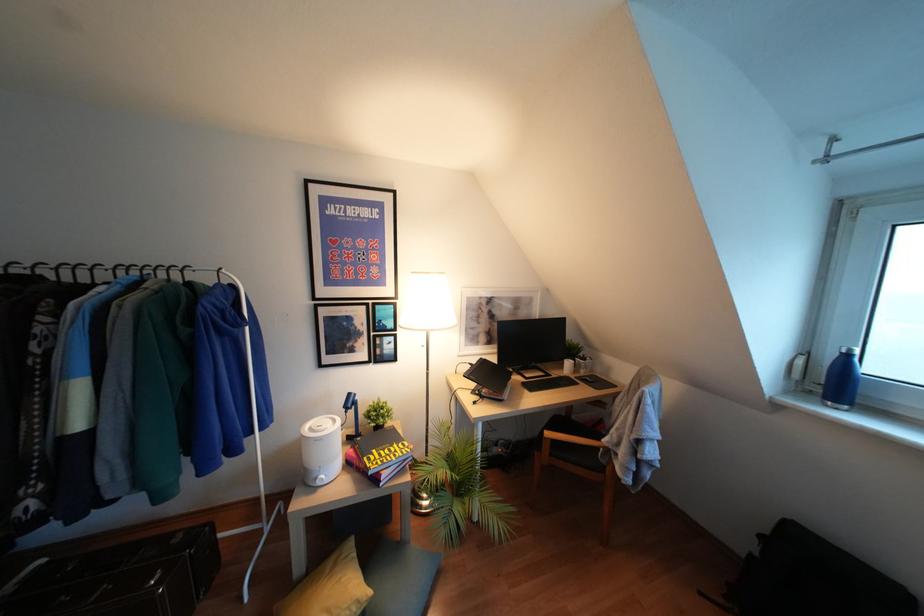
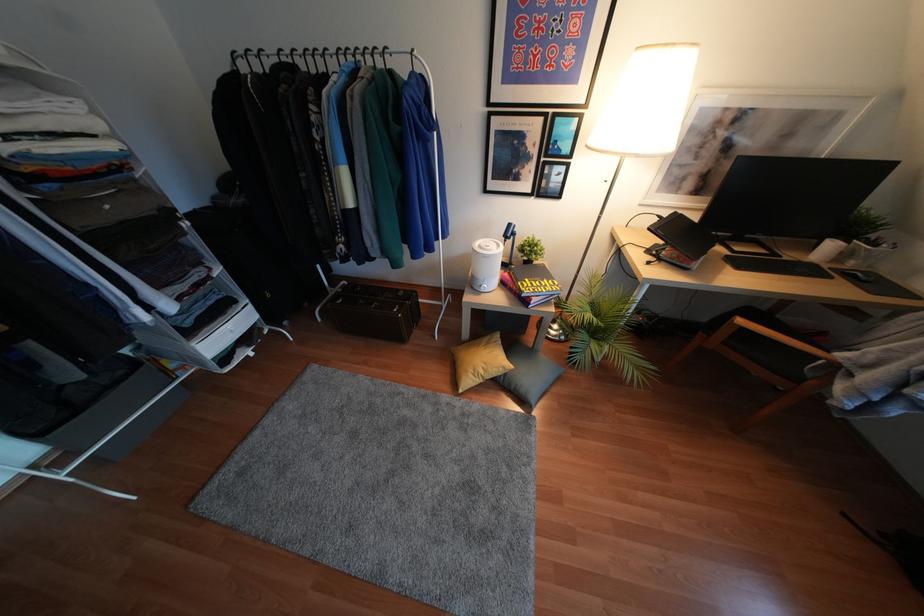
The point at (382, 400) is marked in the first image. Where is the corresponding point in the second image?

(536, 237)